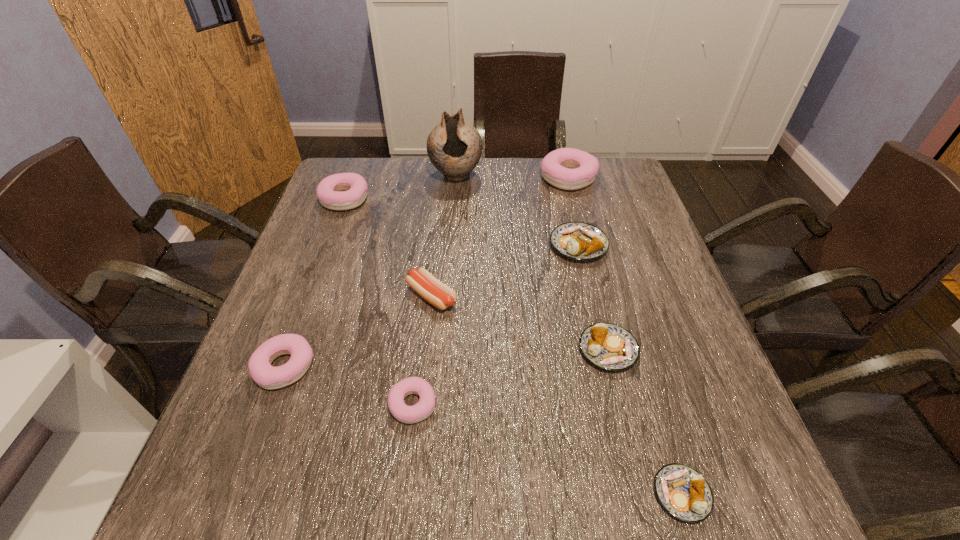
Identify the location of the fifth pastry from right to left. (412, 385).

Find the location of a particular element. The image size is (960, 540). the smallest pink pastry is located at coordinates (412, 385).

Locate an element on the screen. The height and width of the screenshot is (540, 960). the smallest brown pastry is located at coordinates (684, 493).

The height and width of the screenshot is (540, 960). What are the coordinates of `the nearest brown pastry` in the screenshot? It's located at (684, 493).

At what (x,y) coordinates should I click in order to perform the action: click on vacant space located 0.090m from the spout of the pottery. Please return your answer as a coordinate pair (x, y). Looking at the image, I should click on (453, 208).

Where is `vacant point located on the front of the tallest pastry`? vacant point located on the front of the tallest pastry is located at coordinates (597, 288).

Identify the location of free space located 0.080m on the front of the third smallest pink pastry. The image size is (960, 540). (332, 232).

Image resolution: width=960 pixels, height=540 pixels. I want to click on free space located on the left of the fourth farthest object, so click(511, 245).

Find the location of a particular element. The height and width of the screenshot is (540, 960). free spot located 0.110m on the front of the third biggest pink pastry is located at coordinates (254, 451).

Locate an element on the screen. Image resolution: width=960 pixels, height=540 pixels. free space located 0.300m on the front of the fifth farthest object is located at coordinates (416, 450).